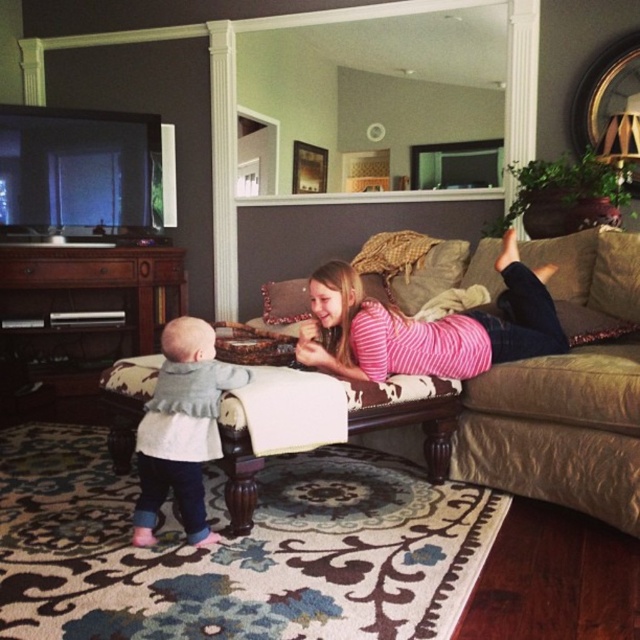
You are a photographer trying to capture the perfect shot of the scene. To ensure the pink striped shirt at center is in the exact center of the photo, where should you position your camera? The coordinates are given as a point between 0 and 1 in both x and y axes, with the origin at the bottom left corner of the image.

The pink striped shirt at center is located at coordinates point (429, 326), so you should position your camera to center the shot at those coordinates to ensure the pink striped shirt at center is precisely centered in the photo.

You are standing in the living room and want to place a small potted plant at the point marked as point [436,332]. If you need to reach it with a 2.5 meter long pole, will you be able to reach that point?

The distance of point [436,332] from viewer is 2.46 meters, so yes, you can reach it with a 2.5 meter long pole since it is slightly shorter than the pole.